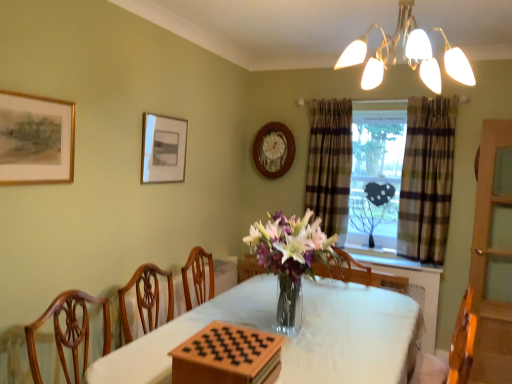
At what (x,y) coordinates should I click in order to perform the action: click on free space behind translucent glass vase at center. Please return your answer as a coordinate pair (x, y). Looking at the image, I should click on (310, 299).